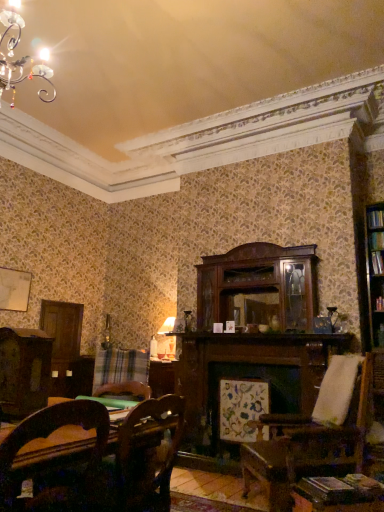
Question: In the image, is plaid fabric at lower left on the left side or the right side of hardcover book at right?

Choices:
 (A) right
 (B) left

Answer: (B)

Question: From the image's perspective, is plaid fabric at lower left above or below hardcover book at right?

Choices:
 (A) below
 (B) above

Answer: (A)

Question: Which object is positioned closest to the wooden chair at lower left?

Choices:
 (A) hardcover book at right
 (B) plaid fabric at lower left
 (C) wooden table at lower right

Answer: (C)

Question: Which is farther from the wooden table at lower right?

Choices:
 (A) wooden chair at lower left
 (B) hardcover book at right
 (C) plaid fabric at lower left

Answer: (C)